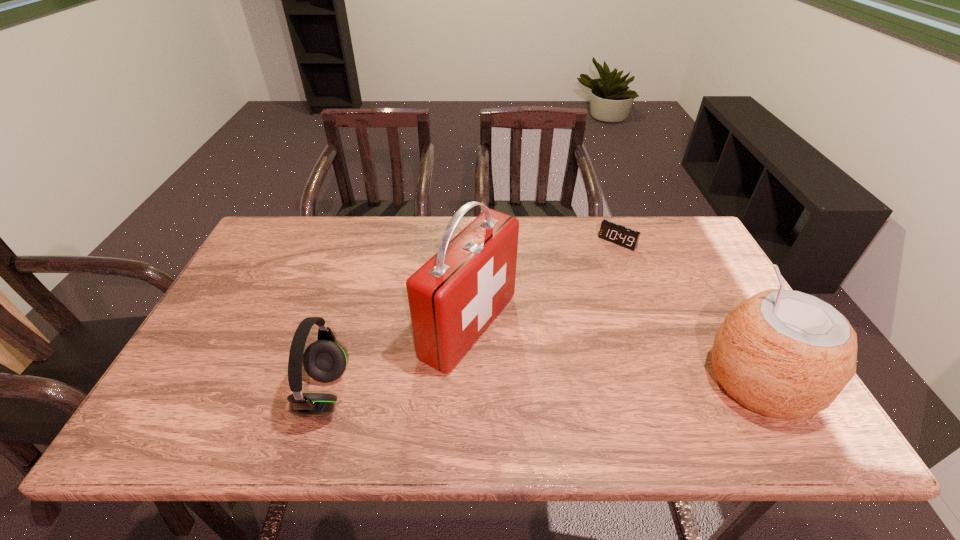
Identify the location of vacant space on the desktop that is between the second shortest object and the third shortest object and is positioned on the front face of the tallest object. The width and height of the screenshot is (960, 540). (593, 386).

Image resolution: width=960 pixels, height=540 pixels. I want to click on vacant space on the desktop that is between the leftmost object and the rightmost object and is positioned on the front-facing side of the third object from left to right, so click(x=497, y=389).